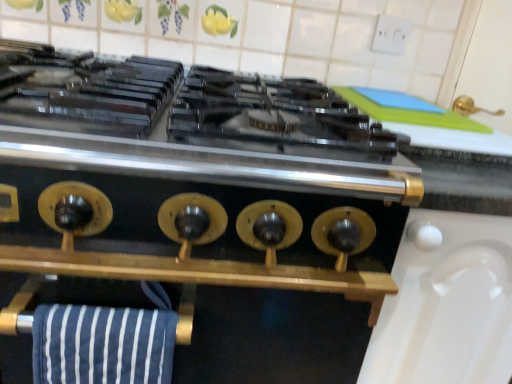
Locate an element on the screen. This screenshot has width=512, height=384. blue striped towel at lower left is located at coordinates (102, 345).

What do you see at coordinates (102, 345) in the screenshot? I see `blue striped towel at lower left` at bounding box center [102, 345].

What do you see at coordinates (193, 217) in the screenshot? I see `gold metallic stove knobs at center` at bounding box center [193, 217].

Image resolution: width=512 pixels, height=384 pixels. What are the coordinates of `gold metallic stove knobs at center` in the screenshot? It's located at (193, 217).

Find the location of a particular element. blue striped towel at lower left is located at coordinates (102, 345).

Between gold metallic stove knobs at center and blue striped towel at lower left, which one appears on the right side from the viewer's perspective?

From the viewer's perspective, blue striped towel at lower left appears more on the right side.

Is gold metallic stove knobs at center positioned behind blue striped towel at lower left?

No, it is not.

Is point (361, 215) farther from viewer compared to point (106, 379)?

Yes, point (361, 215) is behind point (106, 379).

From the image's perspective, is gold metallic stove knobs at center on blue striped towel at lower left?

No, from the image's perspective, gold metallic stove knobs at center is not over blue striped towel at lower left.

From a real-world perspective, is gold metallic stove knobs at center beneath blue striped towel at lower left?

Correct, in the physical world, gold metallic stove knobs at center is lower than blue striped towel at lower left.

Considering the relative sizes of gold metallic stove knobs at center and blue striped towel at lower left in the image provided, is gold metallic stove knobs at center thinner than blue striped towel at lower left?

No.

Considering the sizes of objects gold metallic stove knobs at center and blue striped towel at lower left in the image provided, who is shorter, gold metallic stove knobs at center or blue striped towel at lower left?

With less height is blue striped towel at lower left.

Based on the photo, is gold metallic stove knobs at center smaller than blue striped towel at lower left?

No.

Which is correct: gold metallic stove knobs at center is inside blue striped towel at lower left, or outside of it?

gold metallic stove knobs at center is located beyond the bounds of blue striped towel at lower left.

Based on the photo, is the surface of gold metallic stove knobs at center in direct contact with blue striped towel at lower left?

gold metallic stove knobs at center and blue striped towel at lower left are clearly separated.

Is gold metallic stove knobs at center oriented away from blue striped towel at lower left?

gold metallic stove knobs at center is not turned away from blue striped towel at lower left.

What's the angular difference between gold metallic stove knobs at center and blue striped towel at lower left's facing directions?

The facing directions of gold metallic stove knobs at center and blue striped towel at lower left are 0.000816 degrees apart.

Identify the location of kitchen appliance that appears in front of the blue striped towel at lower left. (193, 217).

Considering the relative positions of blue striped towel at lower left and gold metallic stove knobs at center in the image provided, is blue striped towel at lower left to the left of gold metallic stove knobs at center from the viewer's perspective?

No.

Is blue striped towel at lower left positioned before gold metallic stove knobs at center?

No, it is not.

Is point (100, 368) closer or farther from the camera than point (251, 155)?

Point (100, 368).

From the image's perspective, is blue striped towel at lower left under gold metallic stove knobs at center?

Incorrect, from the image's perspective, blue striped towel at lower left is higher than gold metallic stove knobs at center.

From a real-world perspective, between blue striped towel at lower left and gold metallic stove knobs at center, who is vertically higher?

From a 3D spatial view, blue striped towel at lower left is above.

Which of these two, blue striped towel at lower left or gold metallic stove knobs at center, is wider?

gold metallic stove knobs at center is wider.

Does blue striped towel at lower left have a greater height compared to gold metallic stove knobs at center?

Incorrect, the height of blue striped towel at lower left is not larger of that of gold metallic stove knobs at center.

Considering the sizes of objects blue striped towel at lower left and gold metallic stove knobs at center in the image provided, who is bigger, blue striped towel at lower left or gold metallic stove knobs at center?

gold metallic stove knobs at center.

Is blue striped towel at lower left inside the boundaries of gold metallic stove knobs at center, or outside?

blue striped towel at lower left is inside gold metallic stove knobs at center.

Is blue striped towel at lower left not near gold metallic stove knobs at center?

That's not correct — blue striped towel at lower left is a little close to gold metallic stove knobs at center.

Is blue striped towel at lower left facing away from gold metallic stove knobs at center?

Yes, gold metallic stove knobs at center is at the back of blue striped towel at lower left.

What's the angular difference between blue striped towel at lower left and gold metallic stove knobs at center's facing directions?

The facing directions of blue striped towel at lower left and gold metallic stove knobs at center are 0.000816 degrees apart.

The height and width of the screenshot is (384, 512). In the image, there is a blue striped towel at lower left. Find the location of `kitchen appliance below it (from a real-world perspective)`. kitchen appliance below it (from a real-world perspective) is located at coordinates (193, 217).

Locate an element on the screen. The height and width of the screenshot is (384, 512). beach towel positioned vertically above the gold metallic stove knobs at center (from a real-world perspective) is located at coordinates (102, 345).

Where is `beach towel behind the gold metallic stove knobs at center`? Image resolution: width=512 pixels, height=384 pixels. beach towel behind the gold metallic stove knobs at center is located at coordinates (102, 345).